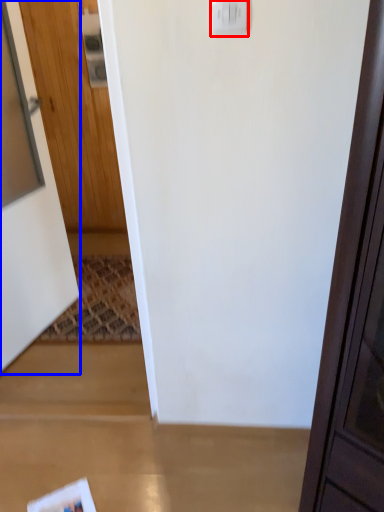
Question: Among these objects, which one is nearest to the camera, light switch (highlighted by a red box) or door (highlighted by a blue box)?

Choices:
 (A) light switch
 (B) door

Answer: (A)